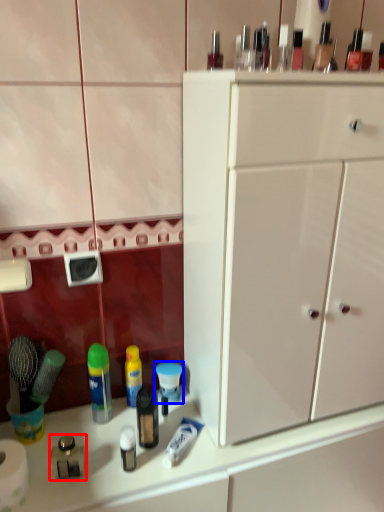
Question: Which point is closer to the camera, toiletry (highlighted by a red box) or toiletry (highlighted by a blue box)?

Choices:
 (A) toiletry
 (B) toiletry

Answer: (A)